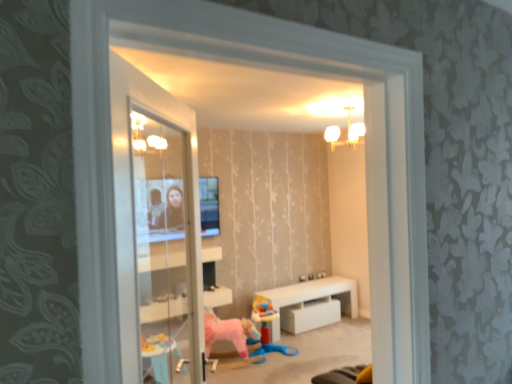
Question: Considering the relative positions of pink fabric horse at center and white glossy table at center in the image provided, is pink fabric horse at center in front of white glossy table at center?

Choices:
 (A) no
 (B) yes

Answer: (B)

Question: From a real-world perspective, is pink fabric horse at center on white glossy table at center?

Choices:
 (A) no
 (B) yes

Answer: (B)

Question: Considering the relative sizes of pink fabric horse at center and white glossy table at center in the image provided, is pink fabric horse at center smaller than white glossy table at center?

Choices:
 (A) yes
 (B) no

Answer: (A)

Question: Is pink fabric horse at center completely or partially outside of white glossy table at center?

Choices:
 (A) no
 (B) yes

Answer: (B)

Question: Considering the relative positions of pink fabric horse at center and white glossy table at center in the image provided, is pink fabric horse at center to the left of white glossy table at center from the viewer's perspective?

Choices:
 (A) yes
 (B) no

Answer: (A)

Question: Is pink fabric horse at center inside or outside of plastic blue toy at center?

Choices:
 (A) outside
 (B) inside

Answer: (A)

Question: Relative to plastic blue toy at center, is pink fabric horse at center in front or behind?

Choices:
 (A) behind
 (B) front

Answer: (B)

Question: Is pink fabric horse at center bigger or smaller than plastic blue toy at center?

Choices:
 (A) big
 (B) small

Answer: (B)

Question: From their relative heights in the image, would you say pink fabric horse at center is taller or shorter than plastic blue toy at center?

Choices:
 (A) short
 (B) tall

Answer: (B)

Question: In the image, is plastic blue toy at center on the left side or the right side of white frosted glass chandelier at upper center?

Choices:
 (A) left
 (B) right

Answer: (A)

Question: Does point (280, 344) appear closer or farther from the camera than point (348, 112)?

Choices:
 (A) farther
 (B) closer

Answer: (A)

Question: From the image's perspective, is plastic blue toy at center above or below white frosted glass chandelier at upper center?

Choices:
 (A) above
 (B) below

Answer: (B)

Question: Is plastic blue toy at center inside or outside of white frosted glass chandelier at upper center?

Choices:
 (A) inside
 (B) outside

Answer: (B)

Question: From the image's perspective, is transparent glass window at center above or below plastic blue toy at center?

Choices:
 (A) above
 (B) below

Answer: (A)

Question: From their relative heights in the image, would you say transparent glass window at center is taller or shorter than plastic blue toy at center?

Choices:
 (A) short
 (B) tall

Answer: (B)